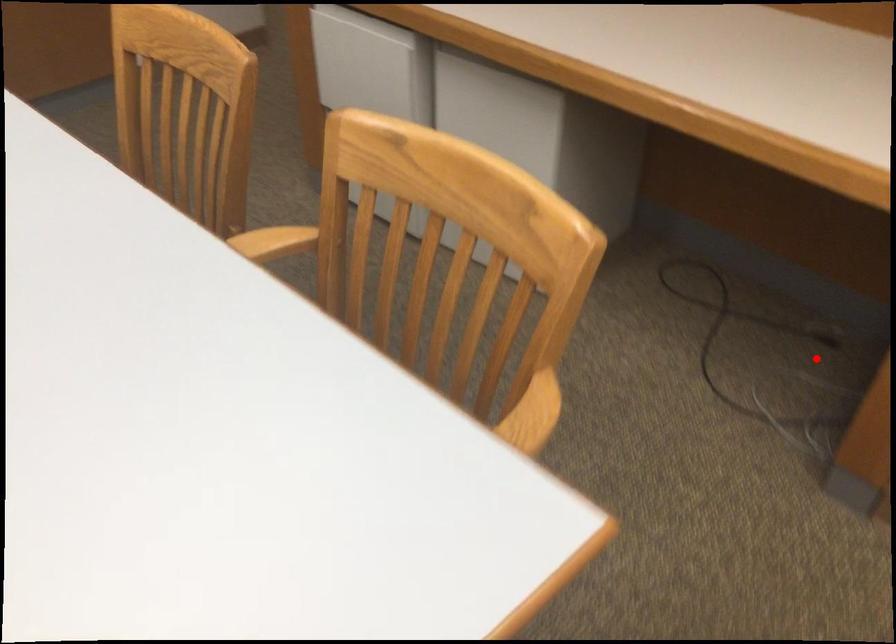
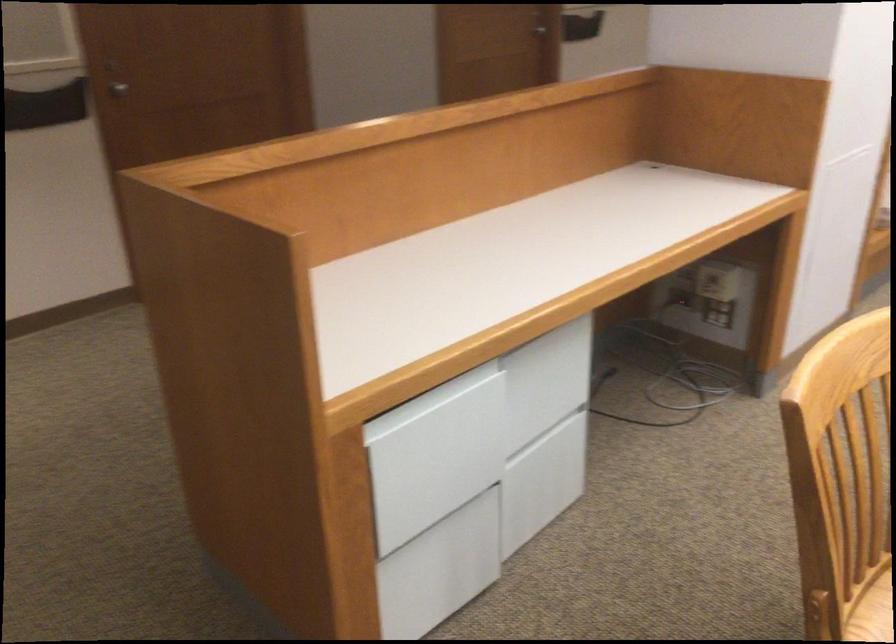
Question: I am providing you with two images of the same scene from different viewpoints. Given a red point in image1, look at the same physical point in image2. Is it:

Choices:
 (A) Closer to the viewpoint
 (B) Farther from the viewpoint

Answer: (B)